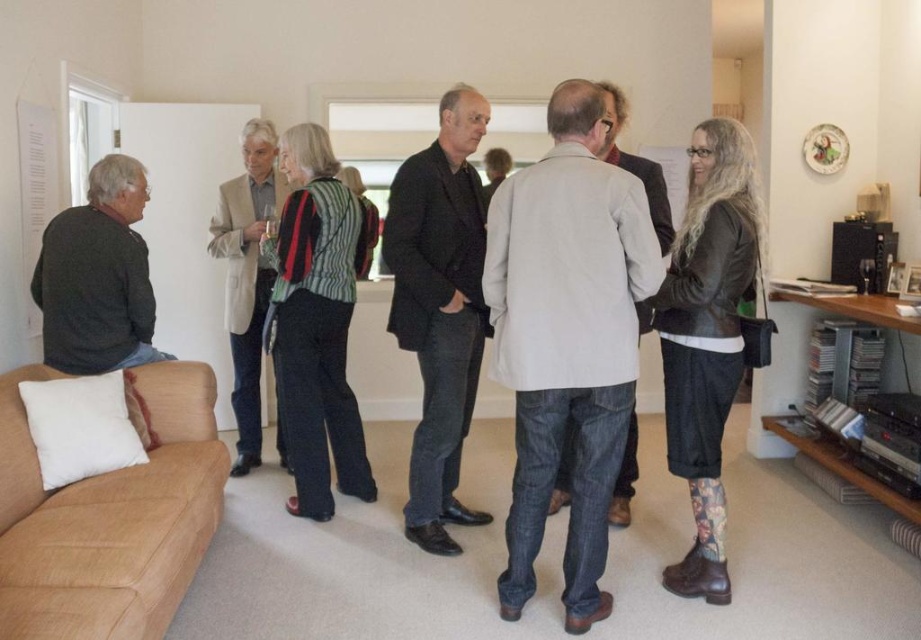
Does dark gray sweater at left appear under light beige woolen blazer at center?

Actually, dark gray sweater at left is above light beige woolen blazer at center.

Is dark gray sweater at left shorter than light beige woolen blazer at center?

Correct, dark gray sweater at left is not as tall as light beige woolen blazer at center.

Who is more distant from viewer, (138, 326) or (257, 310)?

The point (257, 310) is more distant.

Locate an element on the screen. Image resolution: width=921 pixels, height=640 pixels. dark gray sweater at left is located at coordinates (97, 276).

Between point (460, 182) and point (97, 298), which one is positioned behind?

Point (460, 182)

The height and width of the screenshot is (640, 921). I want to click on black matte jacket at center, so click(439, 307).

This screenshot has height=640, width=921. Identify the location of black matte jacket at center. (439, 307).

Is light gray cotton jacket at center bigger than light beige woolen blazer at center?

No, light gray cotton jacket at center is not bigger than light beige woolen blazer at center.

Does light gray cotton jacket at center come in front of light beige woolen blazer at center?

Yes, light gray cotton jacket at center is closer to the viewer.

Is point (577, 248) farther from camera compared to point (263, 266)?

No.

Locate an element on the screen. Image resolution: width=921 pixels, height=640 pixels. light gray cotton jacket at center is located at coordinates (567, 339).